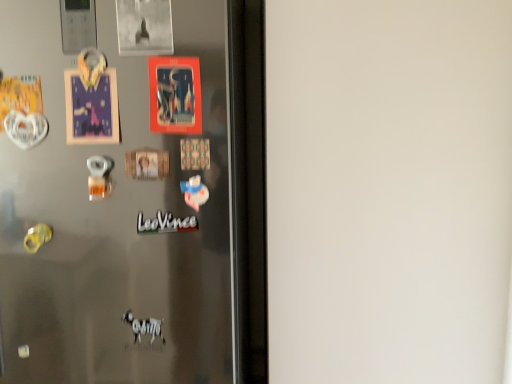
Question: From a real-world perspective, is white matte sticker at center above or below matte plastic postcard at center?

Choices:
 (A) below
 (B) above

Answer: (A)

Question: Considering the positions of white matte sticker at center and matte plastic postcard at center in the image, is white matte sticker at center bigger or smaller than matte plastic postcard at center?

Choices:
 (A) small
 (B) big

Answer: (A)

Question: Considering the real-world distances, which object is farthest from the white matte sticker at center?

Choices:
 (A) matte plastic postcard at center
 (B) satin metallic fridge at center

Answer: (B)

Question: Which object is the farthest from the white matte sticker at center?

Choices:
 (A) satin metallic fridge at center
 (B) matte plastic postcard at center

Answer: (A)